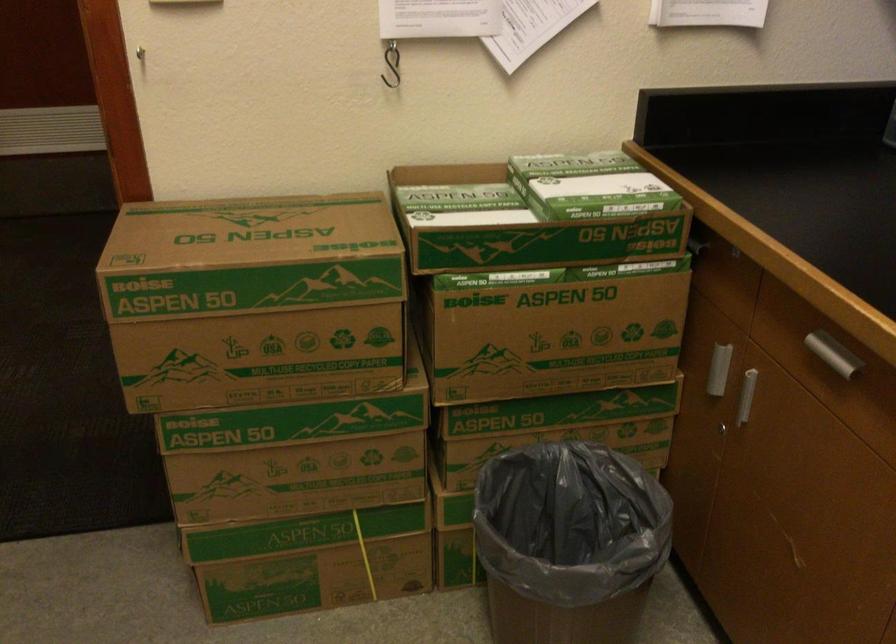
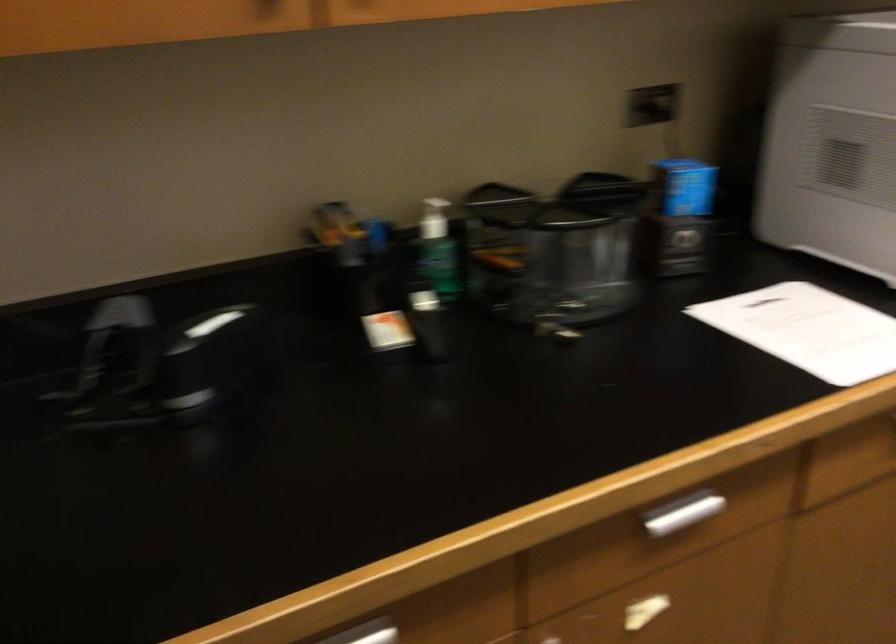
Based on the continuous images, in which direction is the camera rotating?

The camera rotated toward right-down.